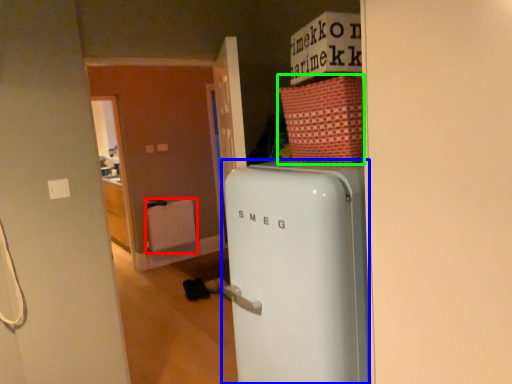
Question: Based on their relative distances, which object is nearer to radiator (highlighted by a red box)? Choose from refrigerator (highlighted by a blue box) and cardboard box (highlighted by a green box).

Choices:
 (A) refrigerator
 (B) cardboard box

Answer: (A)